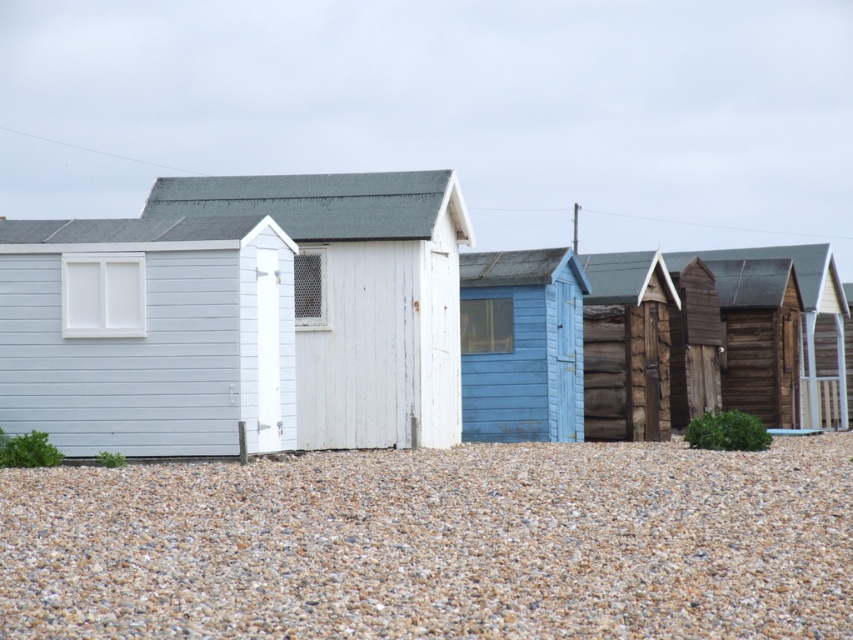
You are planning to install a new solar panel on the roof of the white wooden beach hut at center and the wooden cabin at center. Based on their heights, which structure would require a ladder of greater length to reach its roof?

The wooden cabin at center requires a longer ladder because it is taller than the white wooden beach hut at center.

You are standing at the beach looking at the row of huts. There are two points marked on the sand in front of you. One is at coordinates point (152, 611) and the other is at point (248, 380). Which point is closer to you?

Point (152, 611) is closer to the viewer than point (248, 380).

You are standing at point (421, 579) and want to reach the closest beach hut. Which one is the nearest to you?

The nearest beach hut is the one closest to point (421, 579), but the exact distance isn